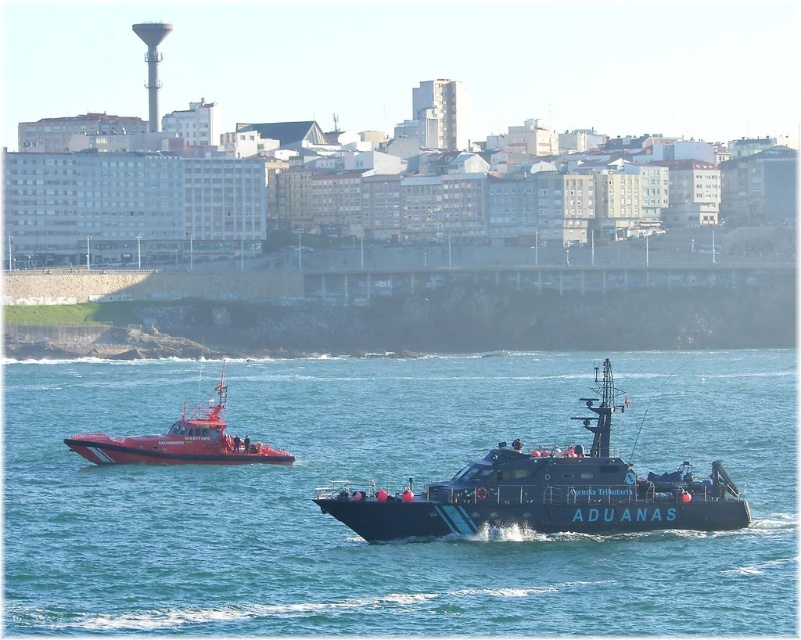
Where is `black matte boat at center`? The image size is (801, 640). black matte boat at center is located at coordinates (546, 492).

Between black matte boat at center and red rubber boat at left, which one has less height?

red rubber boat at left

Between point (518, 445) and point (280, 461), which one is positioned behind?

The point (280, 461) is more distant.

You are a GUI agent. You are given a task and a screenshot of the screen. Output one action in this format:
    pyautogui.click(x=<x>, y=<y>)
    Task: Click on the black matte boat at center
    
    Given the screenshot: What is the action you would take?
    pyautogui.click(x=546, y=492)

Does point (731, 598) come farther from viewer compared to point (215, 387)?

No, it is in front of (215, 387).

You are a GUI agent. You are given a task and a screenshot of the screen. Output one action in this format:
    pyautogui.click(x=<x>, y=<y>)
    Task: Click on the blue water at center
    
    Given the screenshot: What is the action you would take?
    pyautogui.click(x=392, y=486)

Is blue water at center wider than black matte boat at center?

Correct, the width of blue water at center exceeds that of black matte boat at center.

Between point (59, 506) and point (329, 502), which one is positioned behind?

The point (59, 506) is behind.

Find the location of a particular element. Image resolution: width=801 pixels, height=640 pixels. blue water at center is located at coordinates (392, 486).